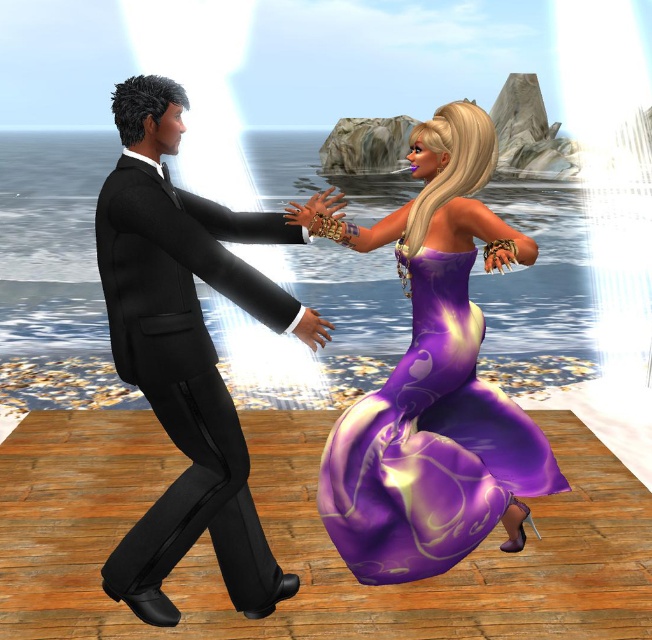
Is matte black suit at left smaller than purple satin dress at center?

No.

Is matte black suit at left to the right of purple satin dress at center from the viewer's perspective?

No, matte black suit at left is not to the right of purple satin dress at center.

This screenshot has height=640, width=652. What are the coordinates of `matte black suit at left` in the screenshot? It's located at (185, 355).

The height and width of the screenshot is (640, 652). I want to click on matte black suit at left, so click(x=185, y=355).